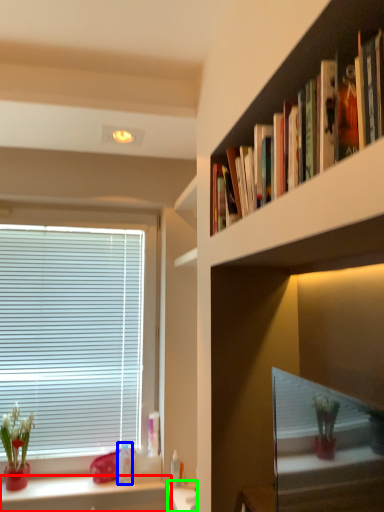
Question: Which object is the farthest from cabinetry (highlighted by a red box)? Choose among these: toiletry (highlighted by a blue box) or vanity (highlighted by a green box).

Choices:
 (A) toiletry
 (B) vanity

Answer: (B)